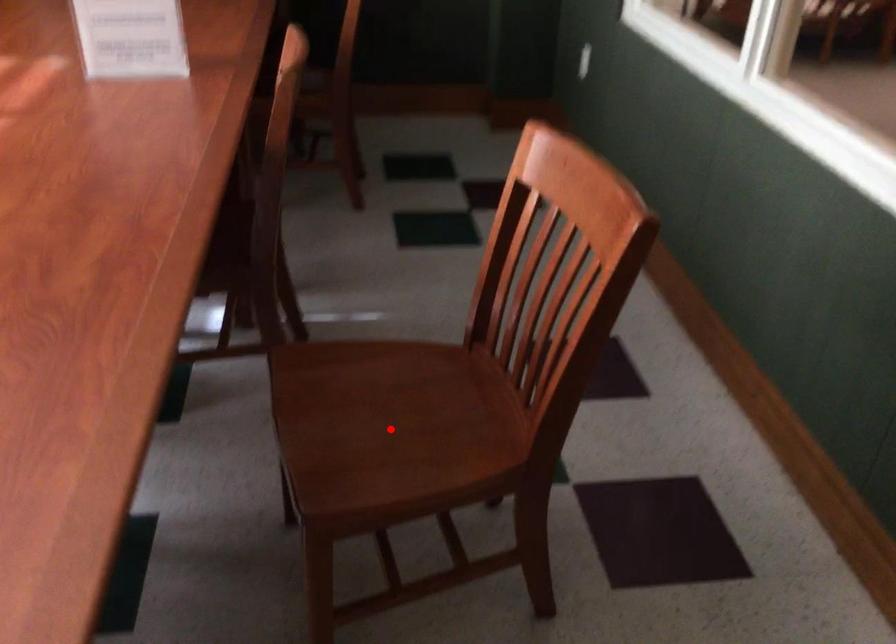
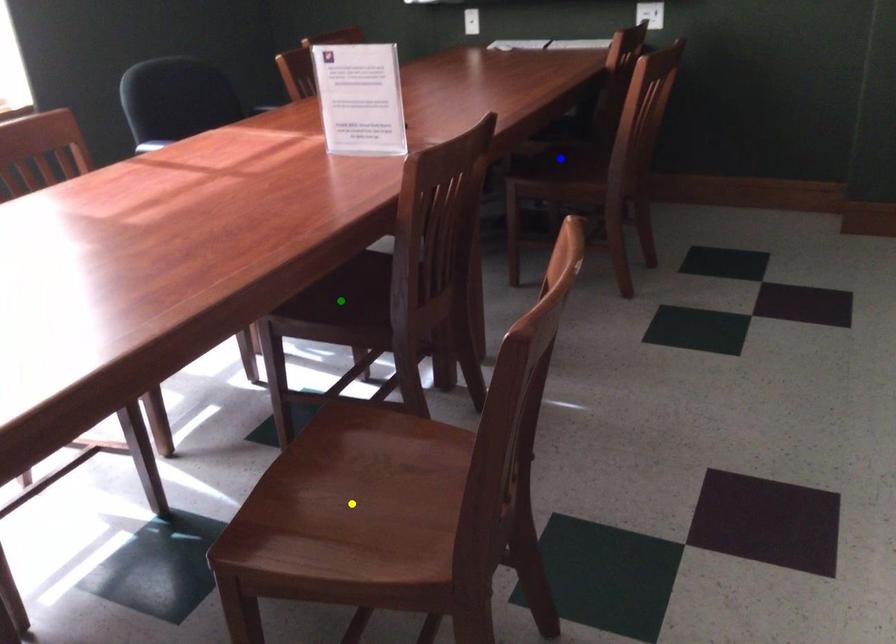
Question: I am providing you with two images of the same scene from different viewpoints. A red point is marked on the first image. You are given multiple points on the second image. Which mark in image 2 goes with the point in image 1?

Choices:
 (A) blue point
 (B) yellow point
 (C) green point

Answer: (B)